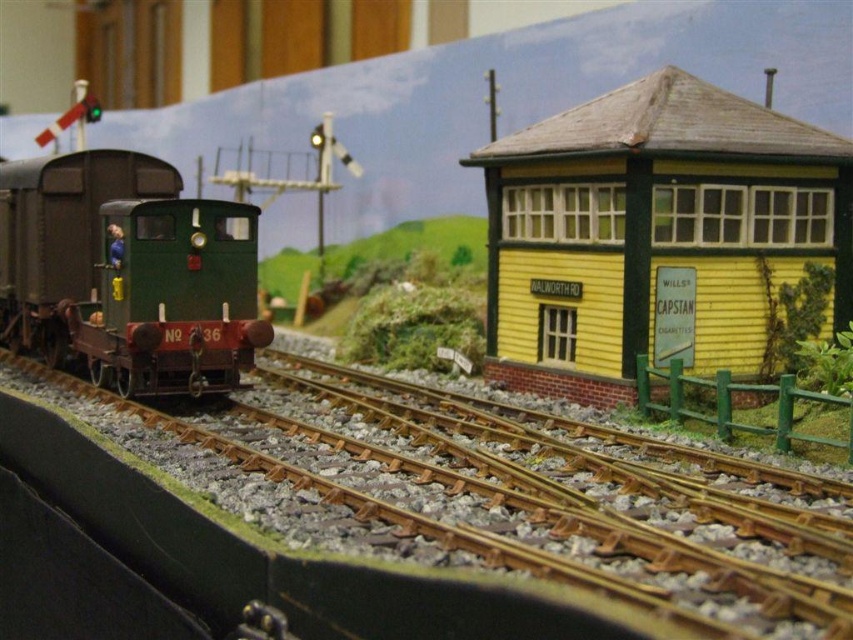
Question: Can you confirm if yellow wood railway station at right is thinner than matte green locomotive at left?

Choices:
 (A) yes
 (B) no

Answer: (A)

Question: Which object is positioned closest to the yellow wood railway station at right?

Choices:
 (A) brown gravel train track at center
 (B) matte green locomotive at left

Answer: (A)

Question: Among these points, which one is nearest to the camera?

Choices:
 (A) (572, 179)
 (B) (689, 506)
 (C) (233, 228)

Answer: (B)

Question: From the image, what is the correct spatial relationship of brown gravel train track at center in relation to matte green locomotive at left?

Choices:
 (A) right
 (B) left

Answer: (A)

Question: Does yellow wood railway station at right come behind matte green locomotive at left?

Choices:
 (A) no
 (B) yes

Answer: (A)

Question: Which object is the closest to the brown gravel train track at center?

Choices:
 (A) yellow wood railway station at right
 (B) matte green locomotive at left

Answer: (B)